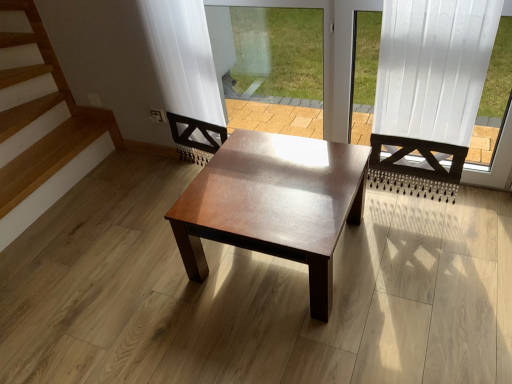
This screenshot has height=384, width=512. In order to click on vacant area that lies between shiny brown wood coffee table at center and white wood frame at upper right in this screenshot , I will do `click(409, 255)`.